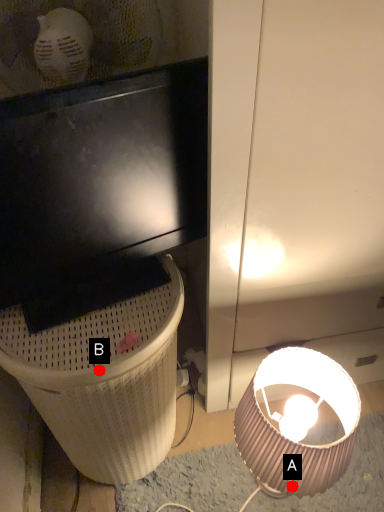
Question: Two points are circled on the image, labeled by A and B beside each circle. Among these points, which one is farthest from the camera?

Choices:
 (A) A is further
 (B) B is further

Answer: (A)